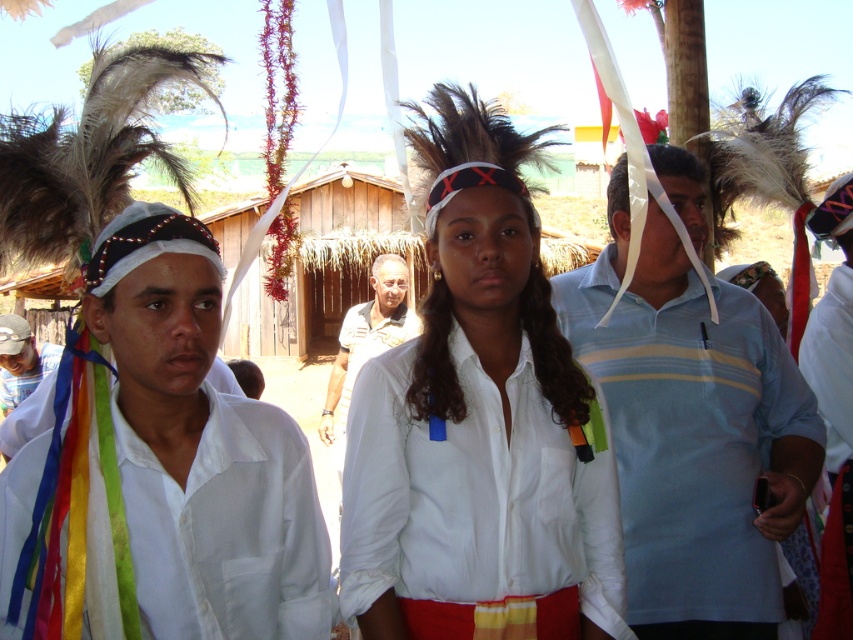
From the picture: You are standing in front of the scene and want to place a small flag at the point closer to you between point (670, 257) and point (13, 358). Which point should you choose?

You should choose point (670, 257) because it is closer to the viewer than point (13, 358).

You are part of a cultural preservation team documenting traditional attire. You notice the black fabric shirt at center and the white fabric at left in the image. Which of these two fabrics is positioned higher up in the scene?

The black fabric shirt at center is much taller as the white fabric at left, so the black fabric shirt at center is positioned higher up in the scene.